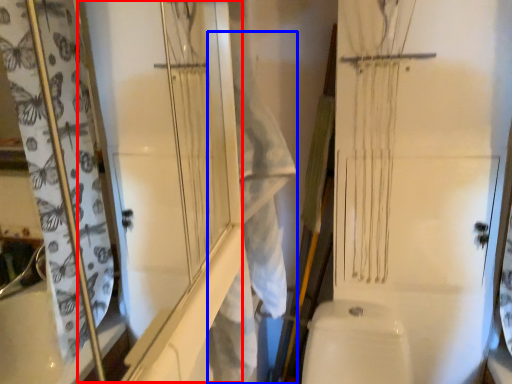
Question: Which point is closer to the camera, screen door (highlighted by a red box) or laundry (highlighted by a blue box)?

Choices:
 (A) screen door
 (B) laundry

Answer: (A)